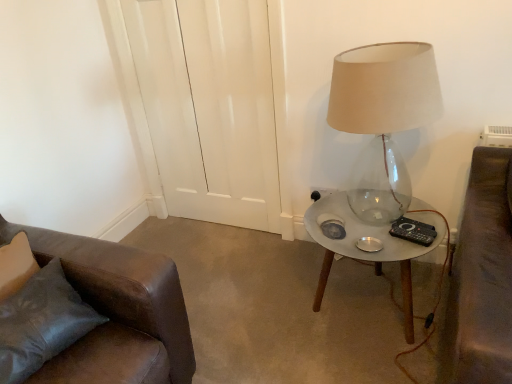
This screenshot has width=512, height=384. I want to click on vacant space to the left of metallic glass table at right, so click(254, 310).